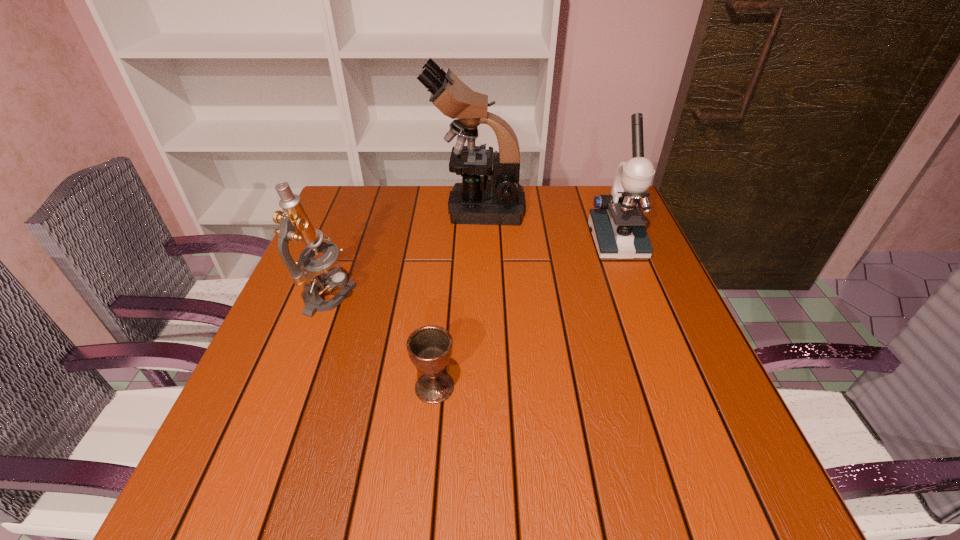
Where is `free space located 0.310m on the right of the shortest object`? This screenshot has width=960, height=540. free space located 0.310m on the right of the shortest object is located at coordinates (621, 387).

Identify the location of object that is at the left edge. click(295, 225).

Find the location of `object present at the right edge`. object present at the right edge is located at coordinates (618, 228).

The height and width of the screenshot is (540, 960). What are the coordinates of `object located in the far right corner section of the desktop` in the screenshot? It's located at (618, 228).

This screenshot has width=960, height=540. Find the location of `vacant area at the far edge of the desktop`. vacant area at the far edge of the desktop is located at coordinates (495, 229).

In the image, there is a desktop. What are the coordinates of `free space at the left edge` in the screenshot? It's located at (238, 420).

Find the location of a particular element. vacant region at the right edge is located at coordinates (696, 343).

This screenshot has width=960, height=540. Identify the location of free region at the far left corner of the desktop. (377, 187).

Identify the location of free space at the near left corner of the desktop. (267, 486).

This screenshot has width=960, height=540. I want to click on blank space at the far right corner, so click(x=600, y=191).